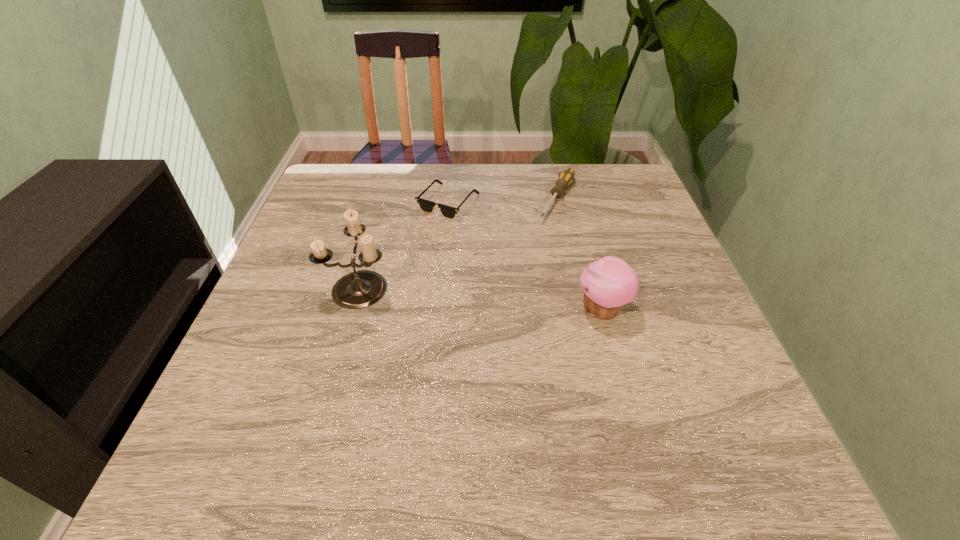
Locate an element on the screen. Image resolution: width=960 pixels, height=540 pixels. vacant spot on the desktop that is between the leftmost object and the second tallest object and is positioned at the tip of the screwdriver is located at coordinates (495, 299).

Identify the location of free space on the desktop that is between the leftmost object and the cupcake and is positioned on the lenses of the second object from left to right. The width and height of the screenshot is (960, 540). (447, 294).